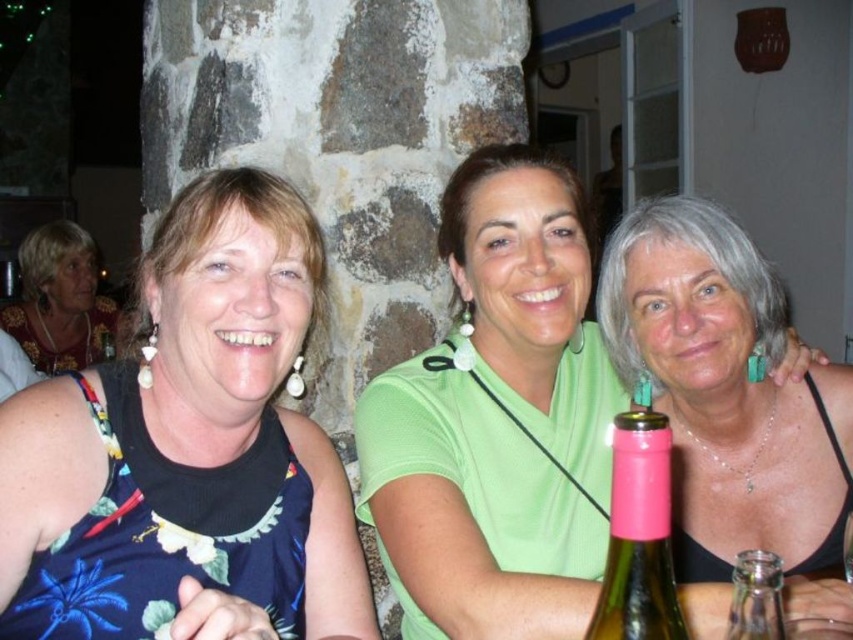
You are a photographer trying to capture a candid shot of the matte black tank top at left and the transparent glass at lower right. Since you want both subjects to be clearly visible, which one should you focus on first to ensure proper focus, considering their sizes?

The matte black tank top at left is bigger than the transparent glass at lower right, so you should focus on the matte black tank top at left first to ensure proper focus since it is larger and more prominent in the frame.